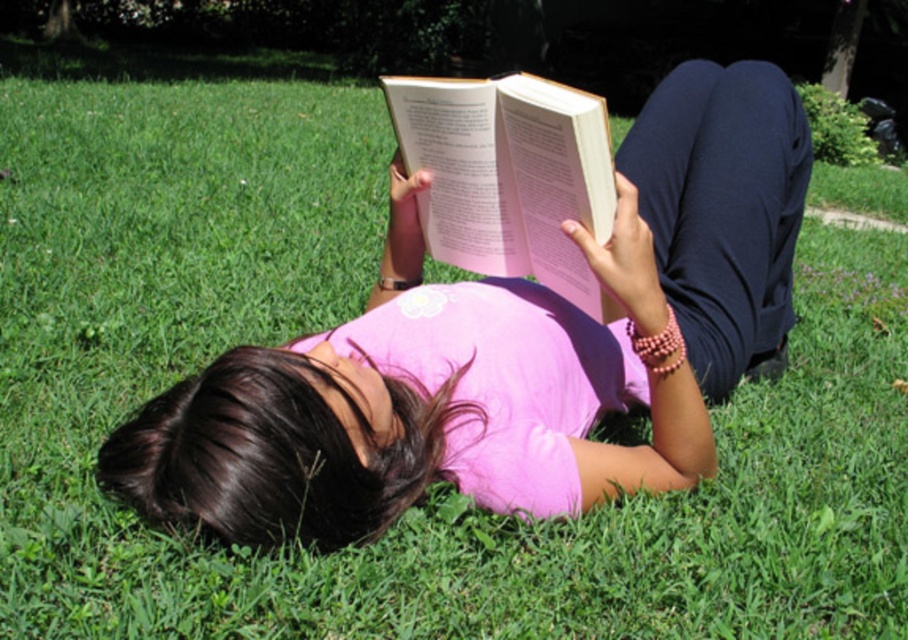
You are a photographer taking a picture of the scene. You notice the pink matte shirt at center is at point (505,349). If you want to focus on the pink matte shirt at center, which coordinate should you adjust your camera to point at?

You should adjust your camera to point at the coordinate (505,349) where the pink matte shirt at center is located.

You are a photographer trying to capture the person in the image. The camera is set to focus on the pink matte shirt at center. What are the coordinates where you should aim the camera?

The coordinates to aim the camera are at point (505, 349) where the pink matte shirt at center is located.

You are a fashion designer observing the scene and want to create a new line of clothing. Considering the pink matte shirt at center and the hardcover book at center, which item has a greater width?

The pink matte shirt at center has a greater width than the hardcover book at center.